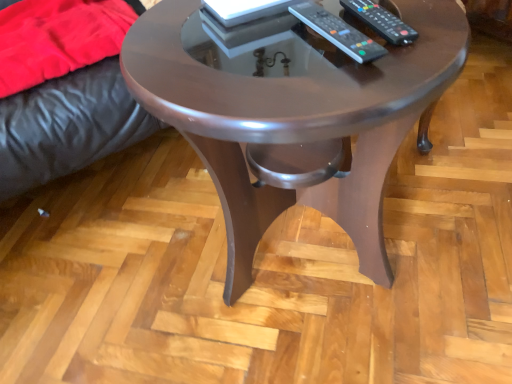
This screenshot has height=384, width=512. I want to click on vacant space underneath shiny brown wood coffee table at center (from a real-world perspective), so click(293, 262).